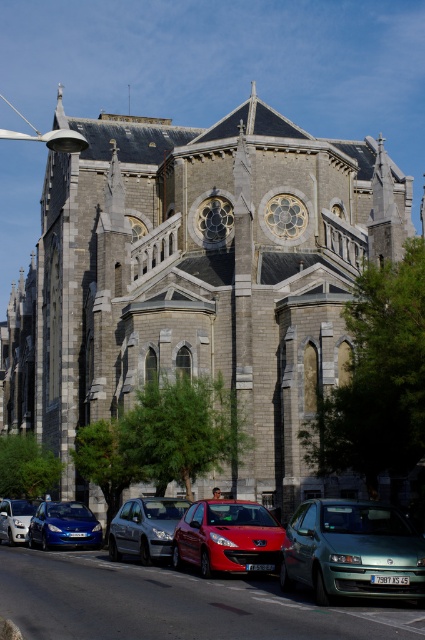
Which is below, shiny red car at center or matte blue car at lower left?

matte blue car at lower left is below.

In order to click on shiny red car at center in this screenshot , I will do `click(226, 538)`.

Find the location of a particular element. Image resolution: width=425 pixels, height=640 pixels. shiny red car at center is located at coordinates (226, 538).

Between gray stone church at center and silver metallic car at lower left, which one appears on the right side from the viewer's perspective?

gray stone church at center is more to the right.

Can you confirm if gray stone church at center is thinner than silver metallic car at lower left?

No, gray stone church at center is not thinner than silver metallic car at lower left.

Does point (393, 236) lie behind point (30, 509)?

Yes, it is behind point (30, 509).

You are a GUI agent. You are given a task and a screenshot of the screen. Output one action in this format:
    pyautogui.click(x=<x>, y=<y>)
    Task: Click on the gray stone church at center
    Image resolution: width=425 pixels, height=640 pixels.
    Given the screenshot: What is the action you would take?
    pyautogui.click(x=198, y=278)

Who is more forward, (167, 154) or (249, 560)?

Point (249, 560) is in front.

Is the position of gray stone church at center less distant than that of shiny red car at center?

No, it is behind shiny red car at center.

Who is more forward, [116,257] or [257,506]?

Point [257,506] is more forward.

Image resolution: width=425 pixels, height=640 pixels. Find the location of `gray stone church at center`. gray stone church at center is located at coordinates (198, 278).